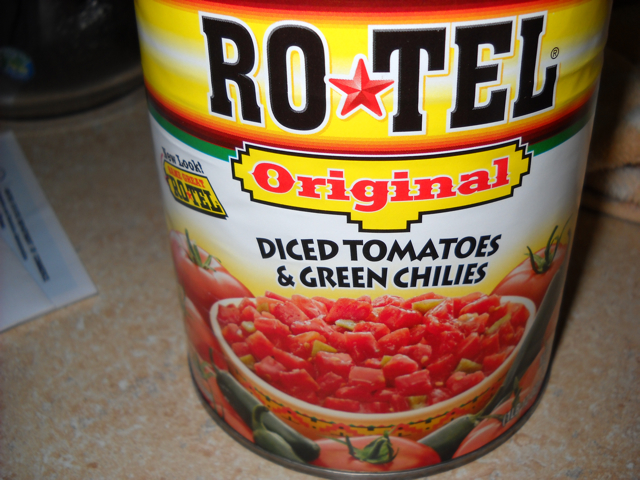
The width and height of the screenshot is (640, 480). I want to click on bowl, so click(x=401, y=425).